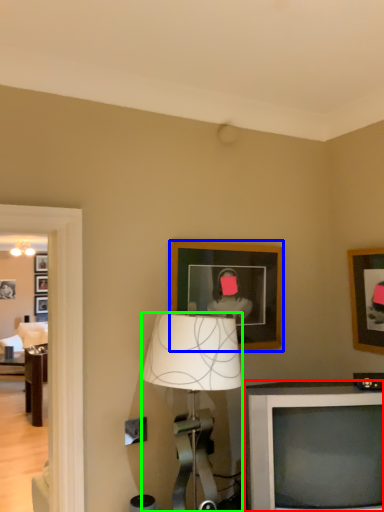
Question: Estimate the real-world distances between objects in this image. Which object is closer to television (highlighted by a red box), picture frame (highlighted by a blue box) or lamp (highlighted by a green box)?

Choices:
 (A) picture frame
 (B) lamp

Answer: (B)